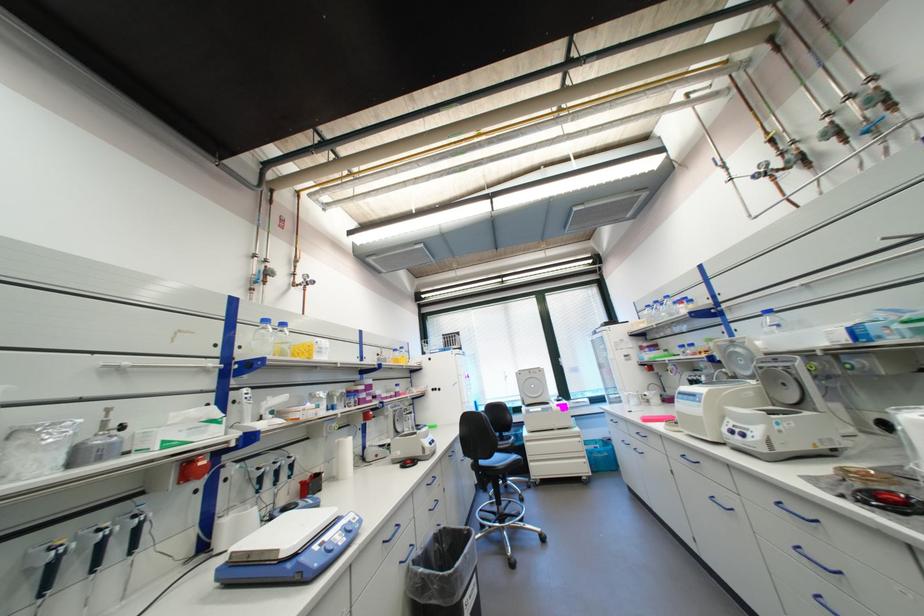
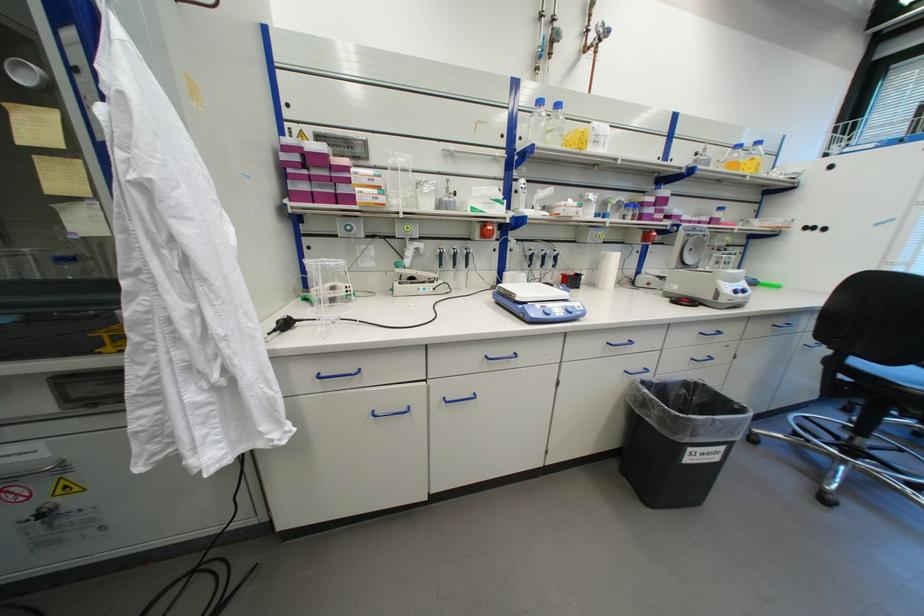
The images are taken continuously from a first-person perspective. In which direction is your viewpoint rotating?

The camera rotated toward left-down.